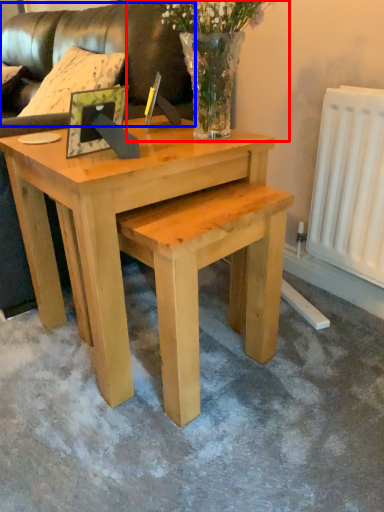
Question: Which point is further to the camera, floral arrangement (highlighted by a red box) or couch (highlighted by a blue box)?

Choices:
 (A) floral arrangement
 (B) couch

Answer: (B)